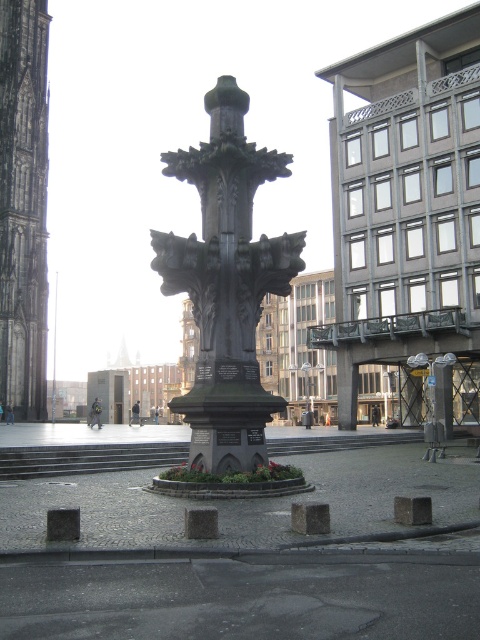
Is point (212, 380) farther from camera compared to point (27, 364)?

No, (212, 380) is in front of (27, 364).

Where is `dark gray stone fountain at center`? The image size is (480, 640). dark gray stone fountain at center is located at coordinates (227, 285).